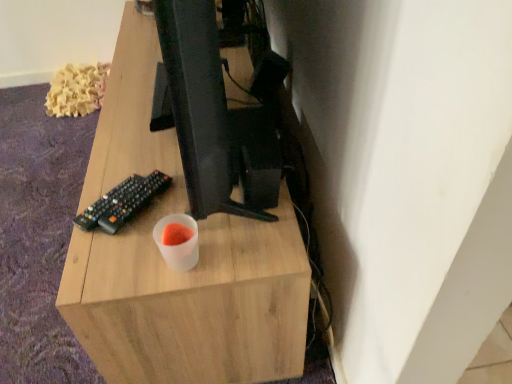
Identify the location of free spot behind black plastic remote control at lower left. (136, 149).